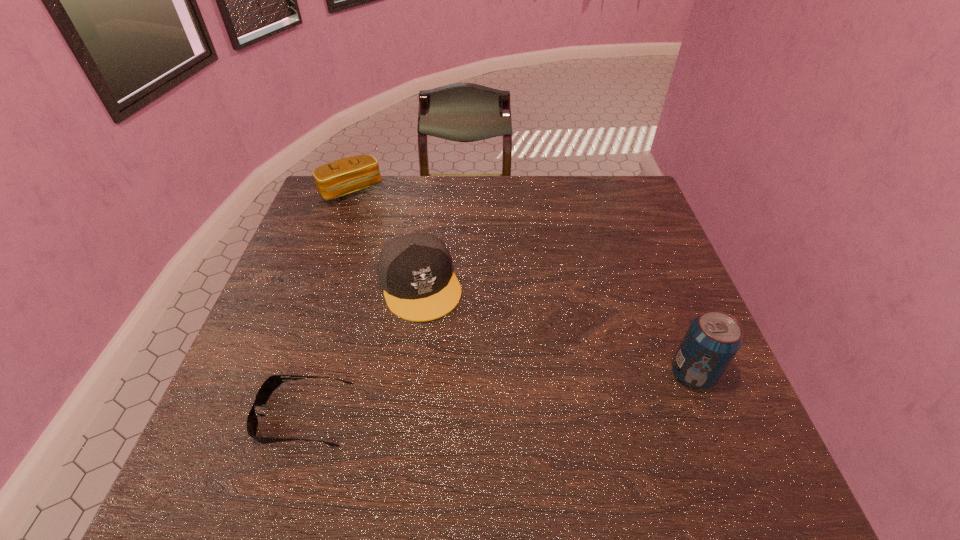
What are the coordinates of `unoccupied position between the farthest object and the sunglasses` in the screenshot? It's located at (327, 302).

Identify the location of vacant space that's between the farthest object and the sunglasses. (327, 302).

Identify the location of vacant space that's between the shortest object and the clutch bag. The width and height of the screenshot is (960, 540). [x=327, y=302].

Where is `free space between the farthest object and the third nearest object`? The height and width of the screenshot is (540, 960). free space between the farthest object and the third nearest object is located at coordinates (385, 238).

You are a GUI agent. You are given a task and a screenshot of the screen. Output one action in this format:
    pyautogui.click(x=<x>, y=<y>)
    Task: Click on the blank region between the shortest object and the pop soda
    The height and width of the screenshot is (540, 960).
    Given the screenshot: What is the action you would take?
    pyautogui.click(x=498, y=394)

You are a GUI agent. You are given a task and a screenshot of the screen. Output one action in this format:
    pyautogui.click(x=<x>, y=<y>)
    Task: Click on the vacant area between the farthest object and the shortest object
    This screenshot has width=960, height=540.
    Given the screenshot: What is the action you would take?
    [327, 302]

What are the coordinates of `free space between the rightmost object and the clutch bag` in the screenshot? It's located at (521, 282).

Locate an element on the screen. Image resolution: width=960 pixels, height=540 pixels. unoccupied area between the rightmost object and the farthest object is located at coordinates (521, 282).

Find the location of a particular element. object that is the third closest one to the sunglasses is located at coordinates (712, 340).

Locate which object ranks second in proximity to the clutch bag. Please provide its 2D coordinates. Your answer should be formatted as a tuple, i.e. [(x, y)], where the tuple contains the x and y coordinates of a point satisfying the conditions above.

[(267, 388)]